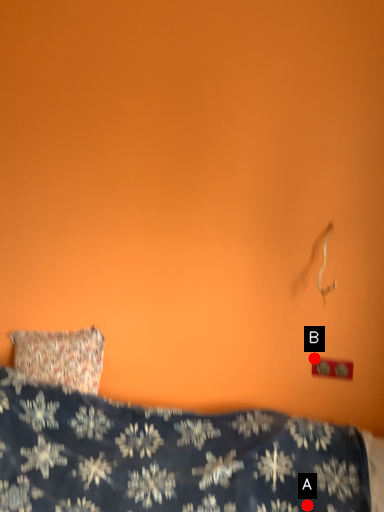
Question: Two points are circled on the image, labeled by A and B beside each circle. Which point appears closest to the camera in this image?

Choices:
 (A) A is closer
 (B) B is closer

Answer: (A)